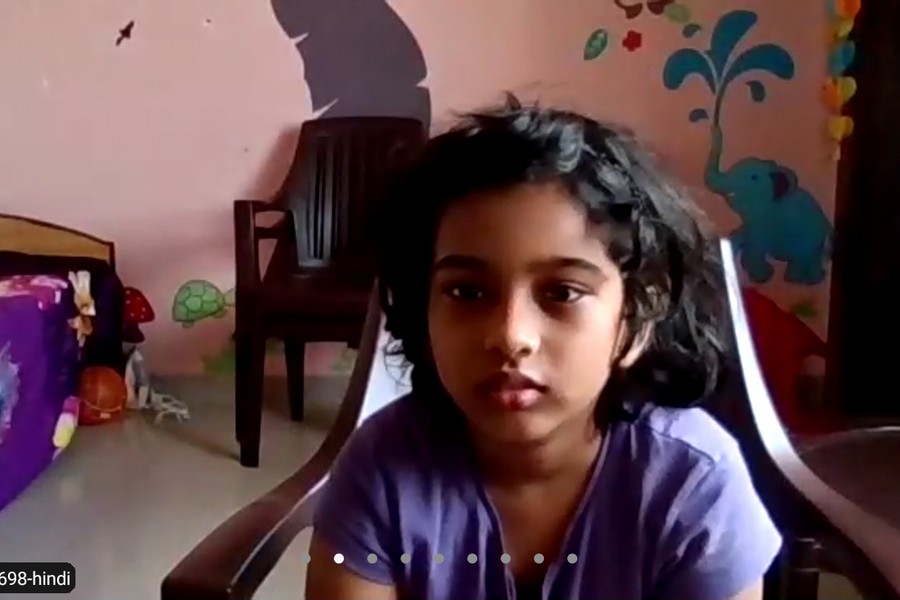
Where is `right arm of chair`? This screenshot has width=900, height=600. right arm of chair is located at coordinates 248,247.